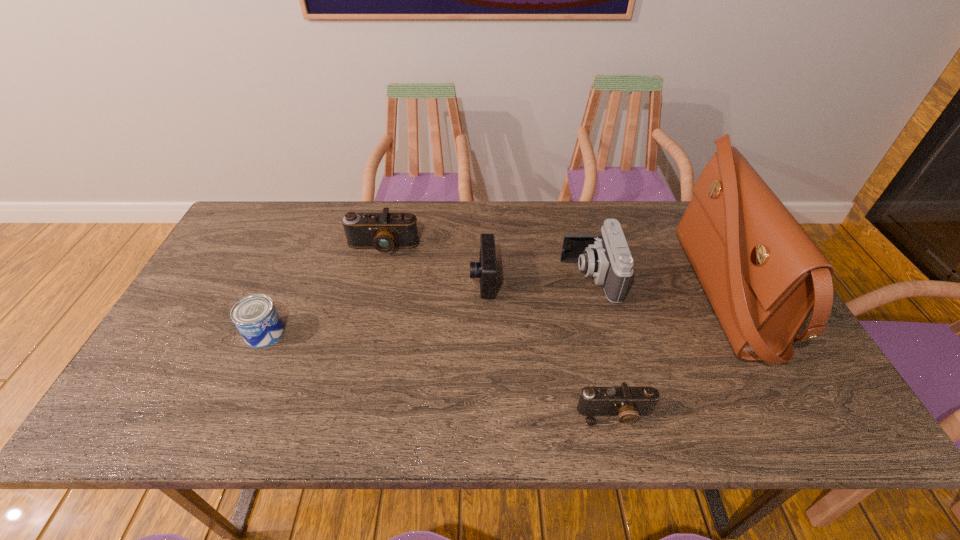
The width and height of the screenshot is (960, 540). Identify the location of camera that is at the far edge. (385, 231).

Image resolution: width=960 pixels, height=540 pixels. Find the location of `object located in the near edge section of the desktop`. object located in the near edge section of the desktop is located at coordinates (628, 403).

Locate an element on the screen. object situated at the right edge is located at coordinates (763, 274).

Where is `object present at the far right corner`? Image resolution: width=960 pixels, height=540 pixels. object present at the far right corner is located at coordinates (763, 274).

What are the coordinates of `vacant space at the far edge of the desktop` in the screenshot? It's located at (457, 224).

At what (x,y) coordinates should I click in order to perform the action: click on free location at the near edge of the desktop. Please return your answer as a coordinate pair (x, y). The image size is (960, 540). Looking at the image, I should click on (566, 414).

The image size is (960, 540). Identify the location of free space at the left edge. (215, 267).

Find the location of a particular element. The height and width of the screenshot is (540, 960). free region at the far left corner of the desktop is located at coordinates (238, 244).

This screenshot has width=960, height=540. I want to click on free space that is in between the shortest object and the can, so click(440, 374).

Locate an element on the screen. The height and width of the screenshot is (540, 960). vacant space that is in between the can and the tallest camera is located at coordinates (427, 305).